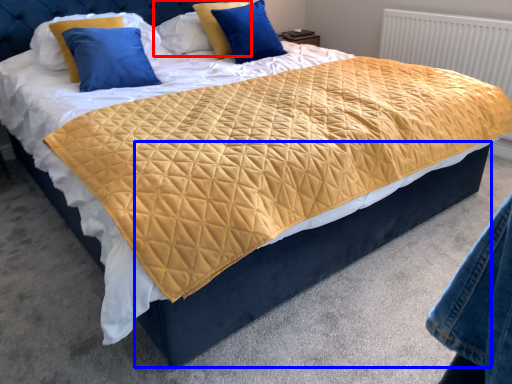
Question: Which point is further to the camera, pillow (highlighted by a red box) or bed frame (highlighted by a blue box)?

Choices:
 (A) pillow
 (B) bed frame

Answer: (A)